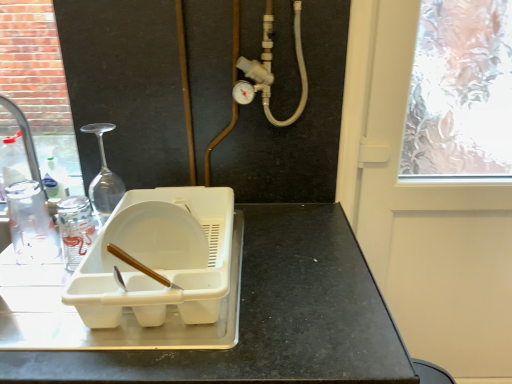
Identify the location of vacant space situated on the left part of clear plastic bottle at left. (36, 261).